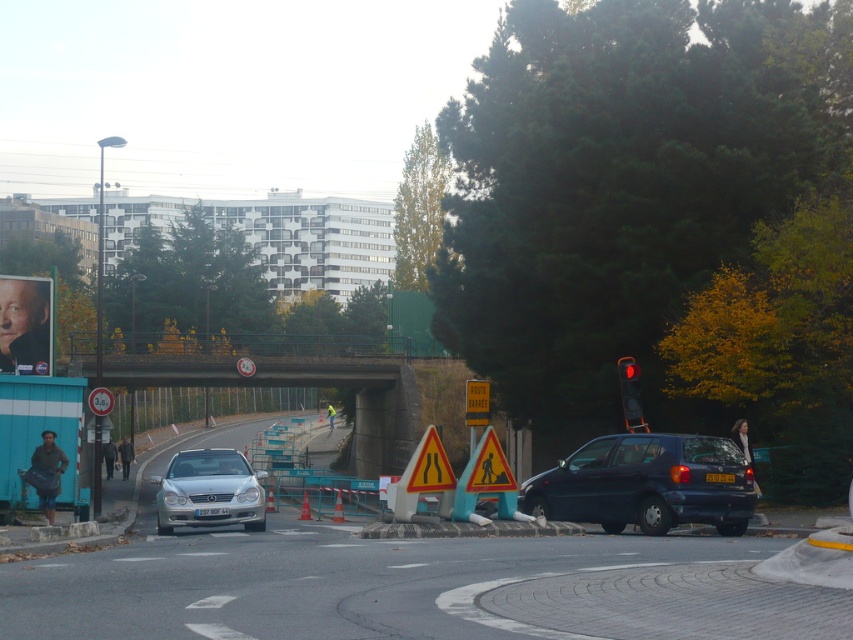
You are a pedestrian standing at the camera position. You see a dark blue matte hatchback at right. Is the car close enough for you to safely cross the road in front of it without worrying about it moving forward?

The dark blue matte hatchback at right is 56.70 feet away from you. Since this distance is quite large, the car is far enough that you can safely cross the road in front of it without worrying about it moving forward.

You are driving a car and see the red glass traffic light at upper right and the yellow plastic road sign at center. Which one is positioned to the right side from your perspective?

The red glass traffic light at upper right is positioned to the right of the yellow plastic road sign at center.

You are a pedestrian standing at the edge of the roundabout and want to cross to the other side. There is a satin silver sedan at center. Where is the satin silver sedan located relative to your position?

The satin silver sedan at center is located at point (209, 490) relative to your position.